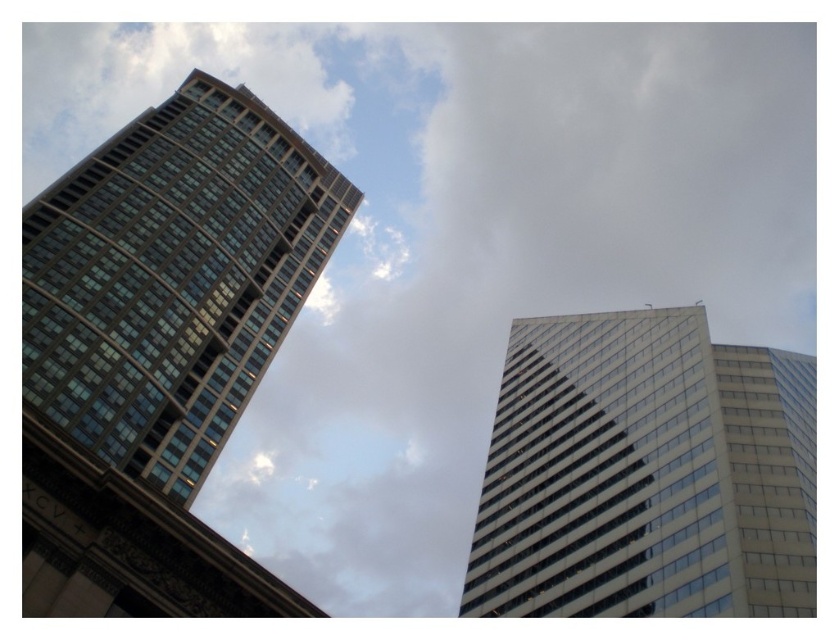
Can you confirm if white glass building at upper right is positioned to the left of glassy reflective building at left?

Incorrect, white glass building at upper right is not on the left side of glassy reflective building at left.

Is white glass building at upper right taller than glassy reflective building at left?

Incorrect, white glass building at upper right's height is not larger of glassy reflective building at left's.

Where is `white glass building at upper right`? white glass building at upper right is located at coordinates (645, 474).